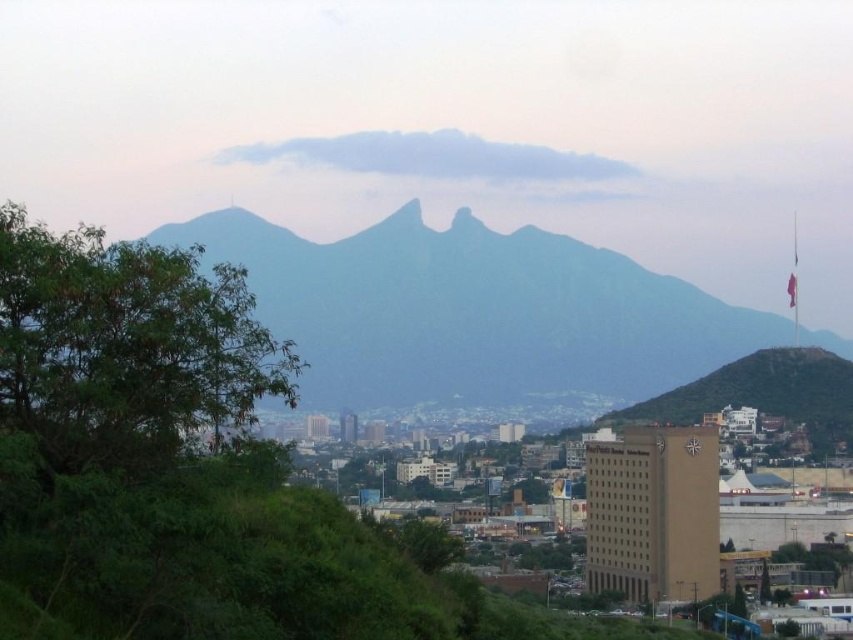
You are a hiker standing on the gray rock formation at center and looking towards the green leafy tree at left. Which direction should you go to reach the tree?

The gray rock formation at center is positioned over the green leafy tree at left, so you should go downward to reach the tree.

You are standing at the point marked by the coordinates point (473, 314) in the cityscape image. What is the object located at that point?

The point (473, 314) in the cityscape image indicates a gray rock formation at center.